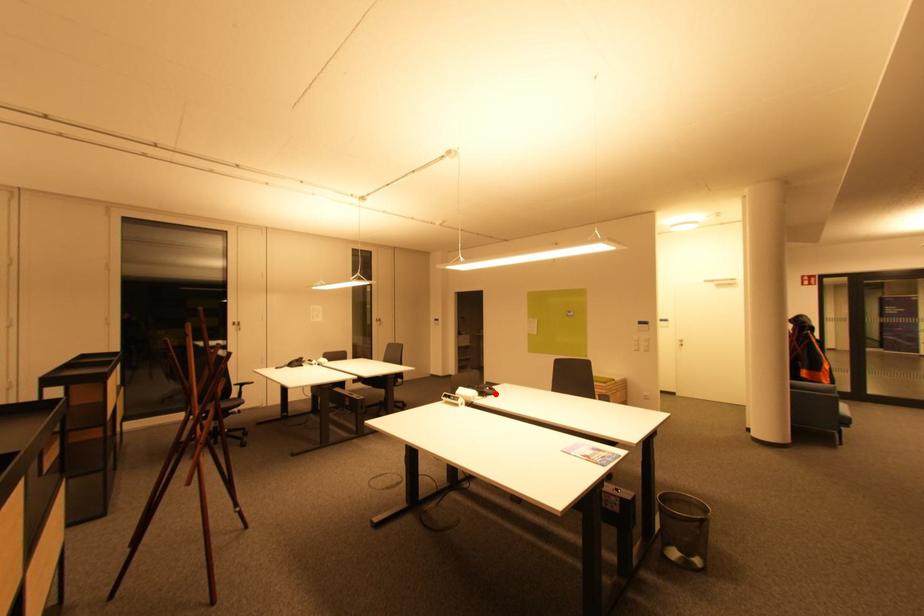
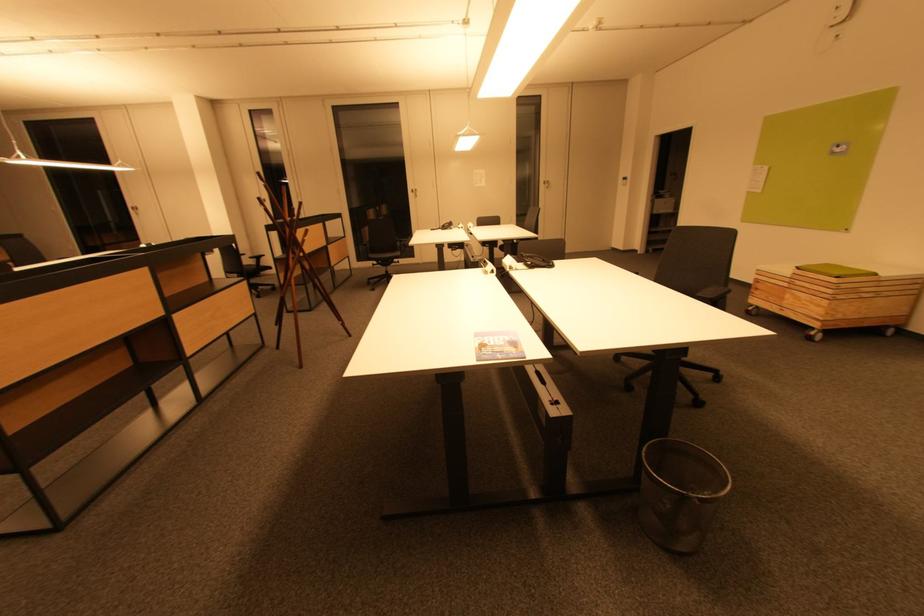
Find the pixel in the second image that matches the highlighted location in the first image.

(548, 265)